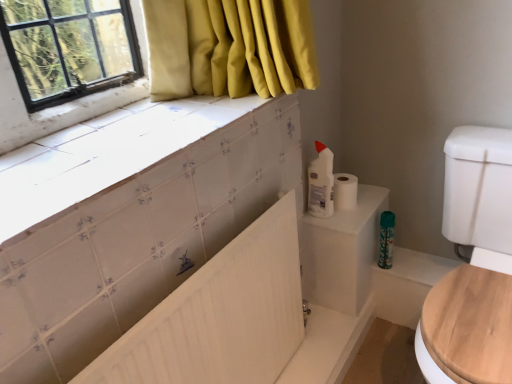
Where is `free location to the right of white plastic bottle at upper right, which is the second cleaning product in right-to-left order`? This screenshot has width=512, height=384. free location to the right of white plastic bottle at upper right, which is the second cleaning product in right-to-left order is located at coordinates (359, 205).